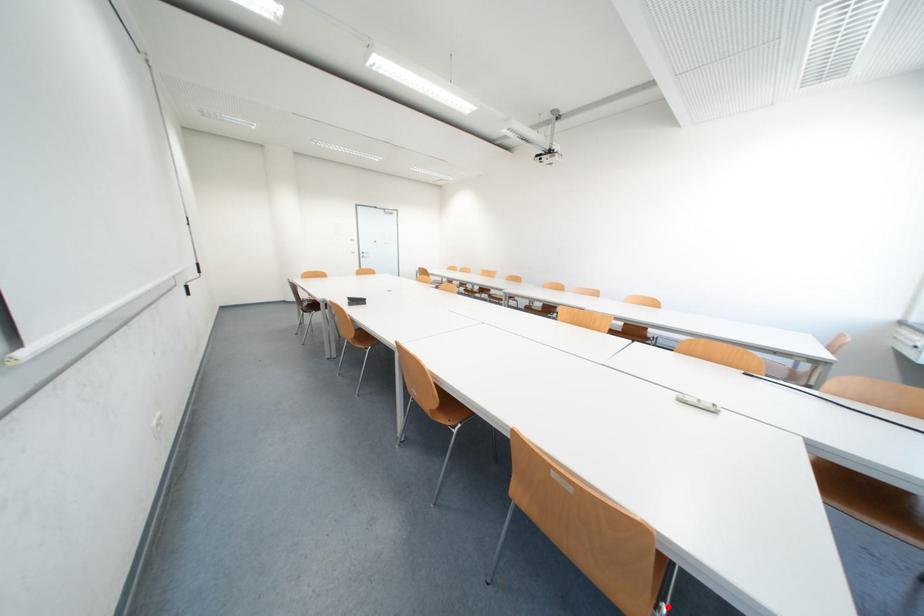
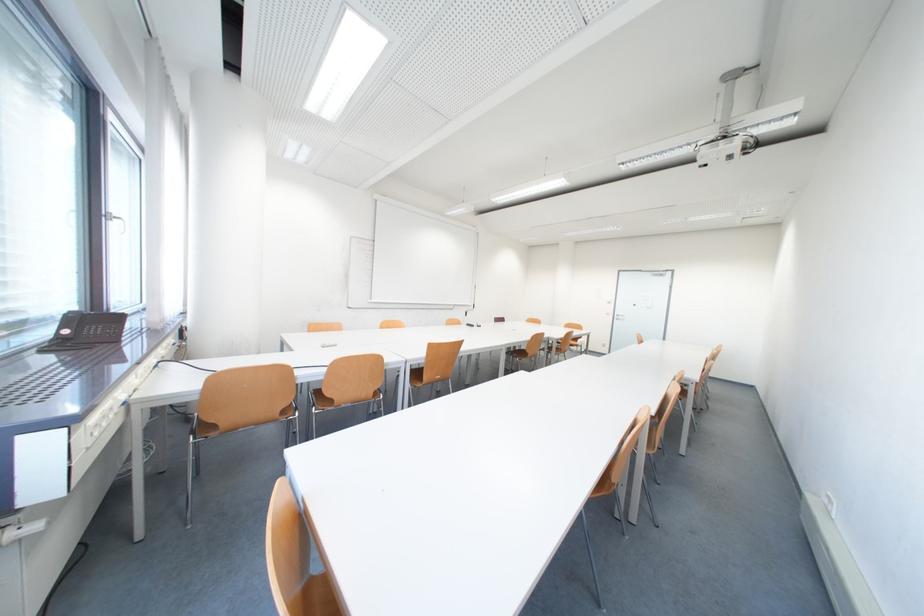
Question: I am providing you with two images of the same scene from different viewpoints. A red point is marked on the first image. Is the red point's position out of view in image 2?

Choices:
 (A) Yes
 (B) No

Answer: (A)